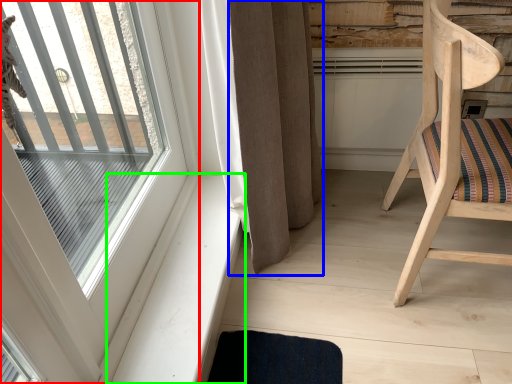
Question: Which object is the closest to the window (highlighted by a red box)? Choose among these: curtain (highlighted by a blue box) or window sill (highlighted by a green box).

Choices:
 (A) curtain
 (B) window sill

Answer: (B)